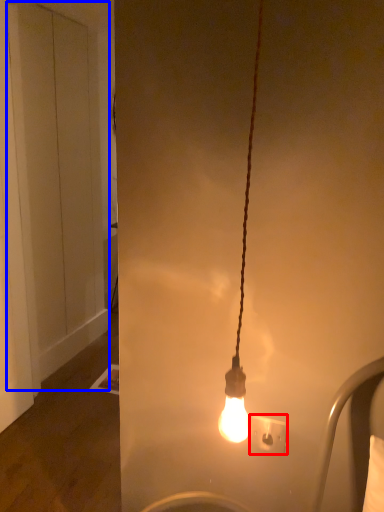
Question: Which of the following is the closest to the observer, power plugs and sockets (highlighted by a red box) or door (highlighted by a blue box)?

Choices:
 (A) power plugs and sockets
 (B) door

Answer: (A)